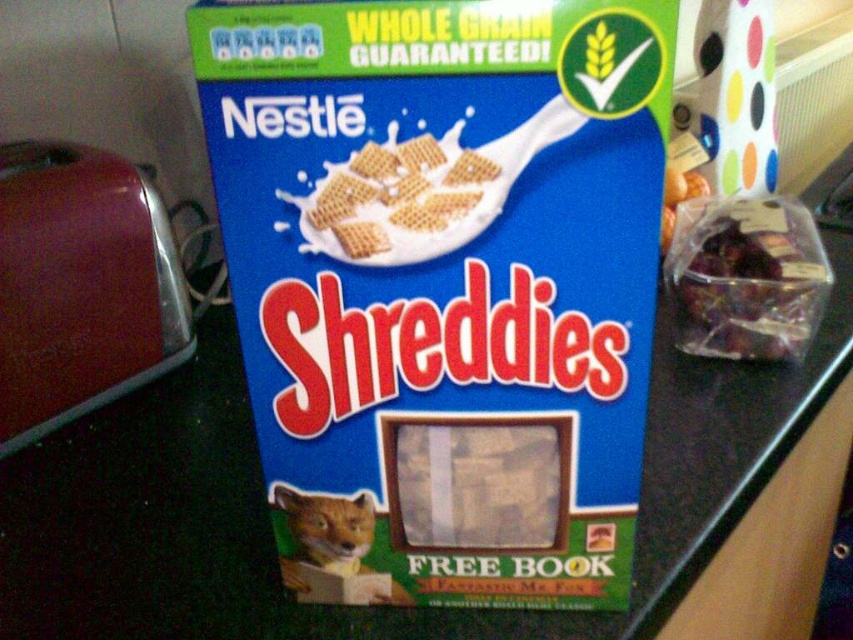
Does blue cardboard box at center have a greater width compared to clear plastic bag of dried fruit at right?

Yes, blue cardboard box at center is wider than clear plastic bag of dried fruit at right.

Measure the distance between point (329, 436) and camera.

Point (329, 436) is 16.05 inches from camera.

Where is `blue cardboard box at center`? The height and width of the screenshot is (640, 853). blue cardboard box at center is located at coordinates (445, 276).

Is point (248, 76) in front of point (369, 529)?

Yes, point (248, 76) is in front of point (369, 529).

Does blue cardboard box at center appear on the right side of orange fur cat at lower left?

Indeed, blue cardboard box at center is positioned on the right side of orange fur cat at lower left.

Who is more distant from viewer, (445, 486) or (289, 515)?

The point (289, 515) is behind.

This screenshot has width=853, height=640. I want to click on blue cardboard box at center, so click(x=445, y=276).

Does blue cardboard box at center have a greater width compared to baked wheat cereal at center?

Yes.

Describe the element at coordinates (445, 276) in the screenshot. I see `blue cardboard box at center` at that location.

Is point (252, 291) behind point (344, 252)?

That is True.

At what (x,y) coordinates should I click in order to perform the action: click on blue cardboard box at center. Please return your answer as a coordinate pair (x, y). This screenshot has height=640, width=853. Looking at the image, I should click on (445, 276).